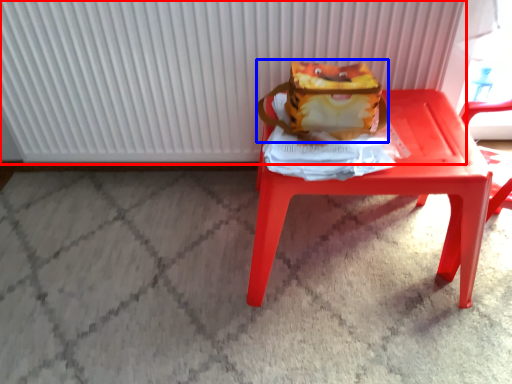
Question: Which object appears farthest to the camera in this image, radiator (highlighted by a red box) or shoulder bag (highlighted by a blue box)?

Choices:
 (A) radiator
 (B) shoulder bag

Answer: (A)